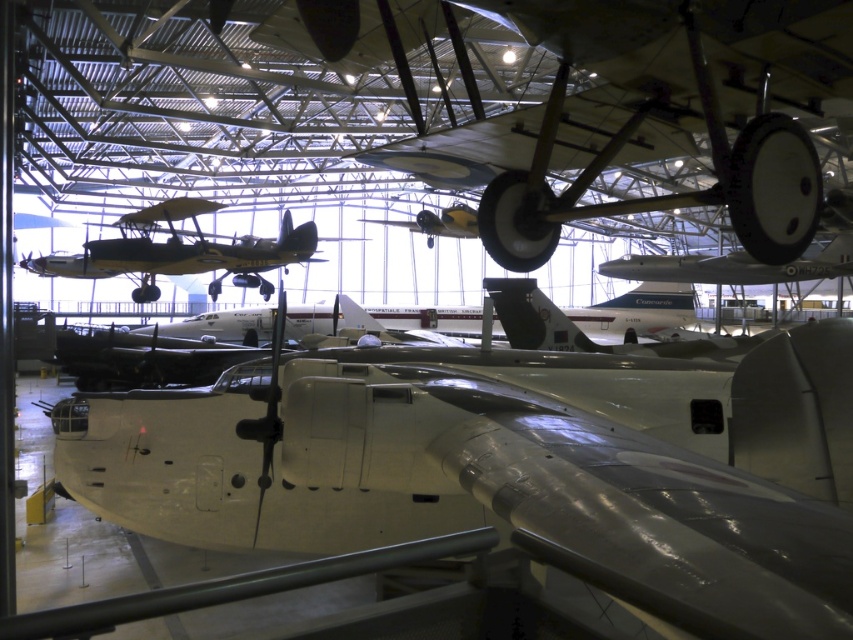
What is the object located at point (x=511, y=467) in the aviation museum image?

The metallic silver airplane at center is located at point (x=511, y=467).